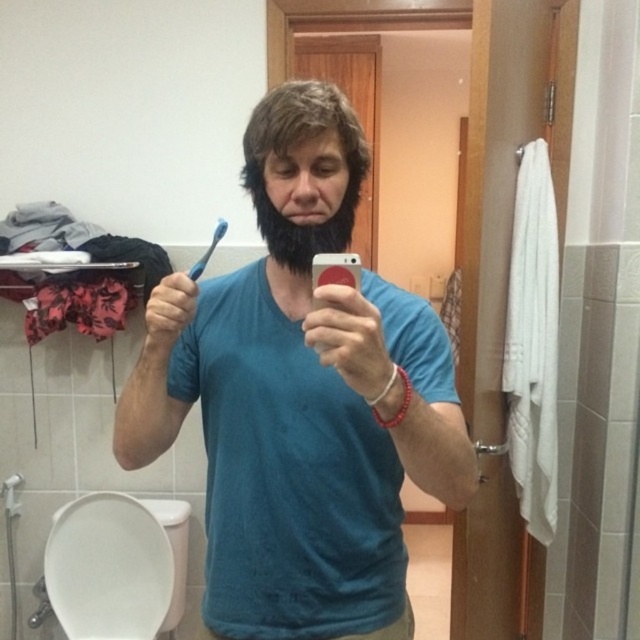
Question: Is blue matte toothbrush at center bigger than blue plastic toothbrush at upper center?

Choices:
 (A) yes
 (B) no

Answer: (A)

Question: Observing the image, what is the correct spatial positioning of blue matte toothbrush at center in reference to white glossy toilet bowl at lower left?

Choices:
 (A) below
 (B) above

Answer: (B)

Question: Which point is closer to the camera?

Choices:
 (A) white glossy toilet bowl at lower left
 (B) blue matte toothbrush at center
 (C) blue plastic toothbrush at upper center

Answer: (B)

Question: Considering the real-world distances, which object is closest to the blue matte toothbrush at center?

Choices:
 (A) blue plastic toothbrush at upper center
 (B) black fuzzy beard at center
 (C) white glossy toilet bowl at lower left

Answer: (B)

Question: Does blue matte toothbrush at center have a smaller size compared to black fuzzy beard at center?

Choices:
 (A) yes
 (B) no

Answer: (B)

Question: Considering the real-world distances, which object is closest to the black fuzzy beard at center?

Choices:
 (A) blue plastic toothbrush at upper center
 (B) blue matte toothbrush at center
 (C) white glossy toilet bowl at lower left

Answer: (B)